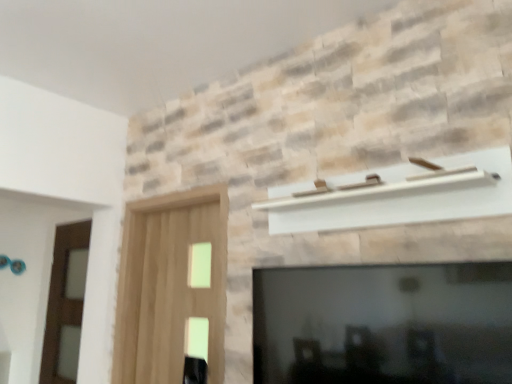
Question: From a real-world perspective, is light brown wood screen door at left, which is the 2th screen door from left to right, located beneath black glass fireplace at lower center?

Choices:
 (A) yes
 (B) no

Answer: (B)

Question: From the image's perspective, is light brown wood screen door at left, which is counted as the first screen door, starting from the front, located beneath black glass fireplace at lower center?

Choices:
 (A) yes
 (B) no

Answer: (A)

Question: From a real-world perspective, is light brown wood screen door at left, which is counted as the first screen door, starting from the front, physically above black glass fireplace at lower center?

Choices:
 (A) yes
 (B) no

Answer: (A)

Question: Can you confirm if light brown wood screen door at left, which appears as the second screen door when viewed from the back, is shorter than black glass fireplace at lower center?

Choices:
 (A) no
 (B) yes

Answer: (A)

Question: Does light brown wood screen door at left, which is the 2th screen door from left to right, have a lesser width compared to black glass fireplace at lower center?

Choices:
 (A) no
 (B) yes

Answer: (A)

Question: Is the surface of light brown wood screen door at left, which is counted as the first screen door, starting from the front, in direct contact with black glass fireplace at lower center?

Choices:
 (A) no
 (B) yes

Answer: (A)

Question: Is brown wooden screen door at left, which is the first screen door in left-to-right order, oriented away from light brown wood screen door at left, which appears as the second screen door when viewed from the back?

Choices:
 (A) yes
 (B) no

Answer: (B)

Question: Can you confirm if brown wooden screen door at left, which is the 2th screen door from front to back, is positioned to the right of light brown wood screen door at left, which is the 2th screen door from left to right?

Choices:
 (A) yes
 (B) no

Answer: (B)

Question: Can you confirm if brown wooden screen door at left, which is the first screen door in left-to-right order, is smaller than light brown wood screen door at left, which appears as the second screen door when viewed from the back?

Choices:
 (A) yes
 (B) no

Answer: (A)

Question: Is brown wooden screen door at left, which is the first screen door in left-to-right order, thinner than light brown wood screen door at left, which is the 2th screen door from left to right?

Choices:
 (A) yes
 (B) no

Answer: (A)

Question: Are brown wooden screen door at left, which is the 1th screen door in back-to-front order, and light brown wood screen door at left, which is counted as the first screen door, starting from the front, located far from each other?

Choices:
 (A) no
 (B) yes

Answer: (B)

Question: From a real-world perspective, is brown wooden screen door at left, the second screen door viewed from the right, on top of light brown wood screen door at left, which is the 2th screen door from left to right?

Choices:
 (A) no
 (B) yes

Answer: (A)

Question: Does brown wooden screen door at left, which is the 1th screen door in back-to-front order, appear on the left side of black glass fireplace at lower center?

Choices:
 (A) no
 (B) yes

Answer: (B)